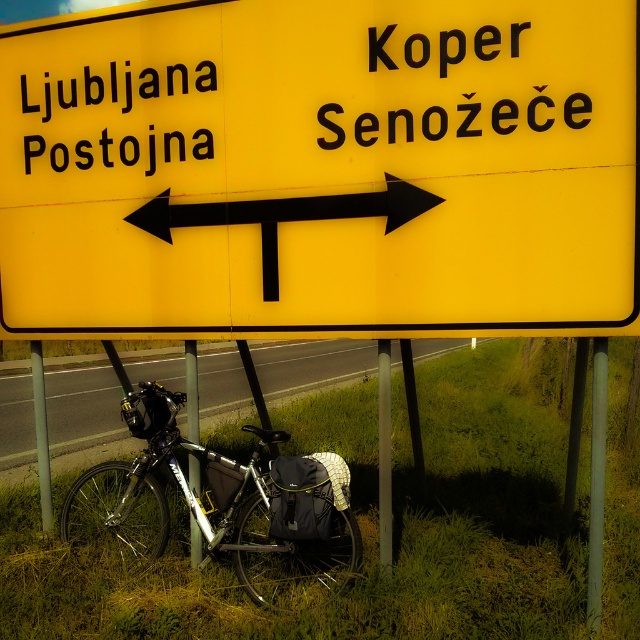
Which of these two, silver metallic bicycle at lower center or black matte arrow at center, stands taller?

silver metallic bicycle at lower center

Between silver metallic bicycle at lower center and black matte arrow at center, which one is positioned lower?

Positioned lower is silver metallic bicycle at lower center.

Is point (246, 525) positioned before point (145, 211)?

No, (246, 525) is further to viewer.

Where is `silver metallic bicycle at lower center`? silver metallic bicycle at lower center is located at coordinates (221, 509).

Between yellow plastic sign at center and black matte arrow at center, which one is positioned lower?

black matte arrow at center is lower down.

Looking at this image, between yellow plastic sign at center and black matte arrow at center, which one is positioned higher?

Positioned higher is yellow plastic sign at center.

Find the location of a particular element. yellow plastic sign at center is located at coordinates [x=321, y=170].

Identify the location of yellow plastic sign at center. (321, 170).

Is yellow plastic sign at center shorter than metallic bicycle at lower left?

Incorrect, yellow plastic sign at center's height does not fall short of metallic bicycle at lower left's.

From the picture: Does yellow plastic sign at center come behind metallic bicycle at lower left?

No.

Who is more forward, (493, 116) or (406, 477)?

Point (493, 116)

Identify the location of yellow plastic sign at center. (321, 170).